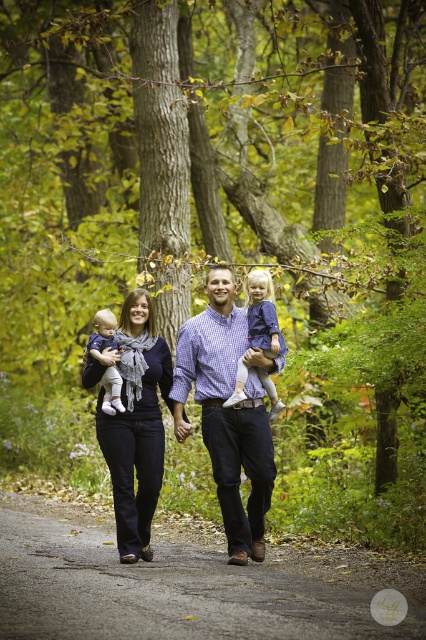
You are standing in the forest path and see two points marked in the scene. Which point is closer to you, point (213, 400) or point (88, 349)?

Point (213, 400) is closer to you than point (88, 349).

You are a photographer trying to capture the family in the scene. You notice the dark blue jeans at center and the soft white fabric baby at center. Which object is positioned to the right of the other?

The dark blue jeans at center are to the right of the soft white fabric baby at center.